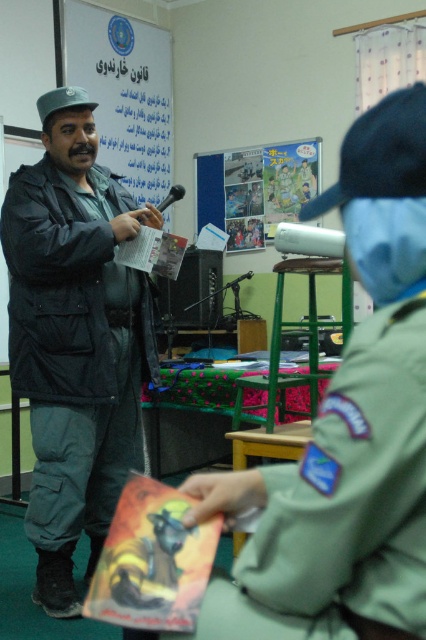
Question: Does green uniform at center appear under dark green uniform at center?

Choices:
 (A) no
 (B) yes

Answer: (A)

Question: Based on their relative distances, which object is farther from the green uniform at center?

Choices:
 (A) white matte poster at upper center
 (B) dark green uniform at center

Answer: (A)

Question: Can you confirm if green uniform at center is positioned to the right of white matte poster at upper center?

Choices:
 (A) yes
 (B) no

Answer: (A)

Question: Can you confirm if green uniform at center is positioned below dark green uniform at center?

Choices:
 (A) no
 (B) yes

Answer: (A)

Question: Among these objects, which one is farthest from the camera?

Choices:
 (A) white matte poster at upper center
 (B) dark green uniform at center

Answer: (A)

Question: Which point is farther to the camera?

Choices:
 (A) green uniform at center
 (B) dark green uniform at center
 (C) white matte poster at upper center

Answer: (C)